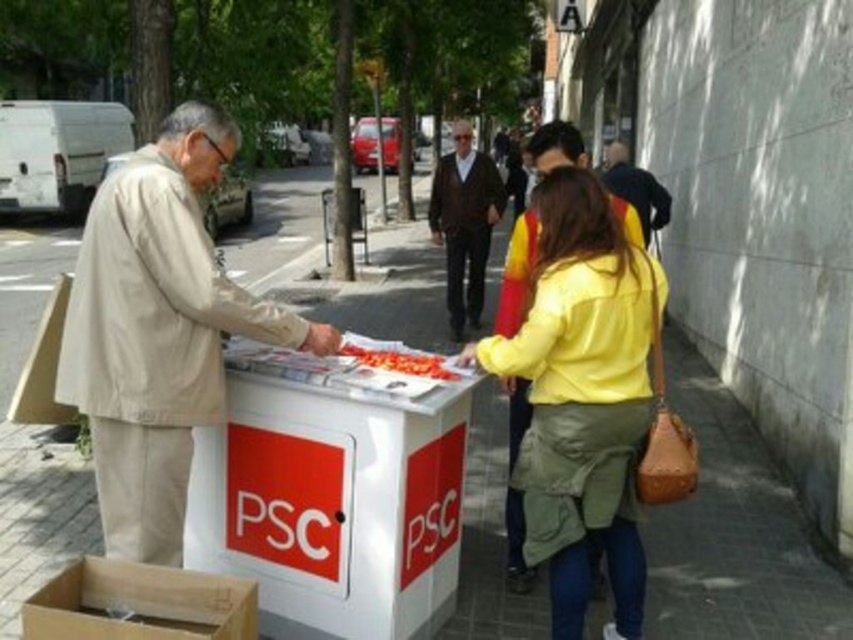
Question: Does white smooth pavement at center come behind yellow matte jacket at center?

Choices:
 (A) no
 (B) yes

Answer: (B)

Question: Among these objects, which one is farthest from the camera?

Choices:
 (A) yellow matte jacket at center
 (B) white smooth pavement at center
 (C) dark brown sweater at center

Answer: (C)

Question: Is white smooth pavement at center positioned at the back of brown cardboard box at lower left?

Choices:
 (A) no
 (B) yes

Answer: (B)

Question: Is yellow matte jacket at center further to camera compared to brown cardboard box at lower left?

Choices:
 (A) yes
 (B) no

Answer: (A)

Question: Which object is positioned farthest from the white smooth pavement at center?

Choices:
 (A) brown cardboard box at lower left
 (B) beige fabric jacket at left

Answer: (B)

Question: Which of the following is the closest to the observer?

Choices:
 (A) brown cardboard box at lower left
 (B) beige fabric jacket at left
 (C) dark brown sweater at center
 (D) white smooth pavement at center

Answer: (A)